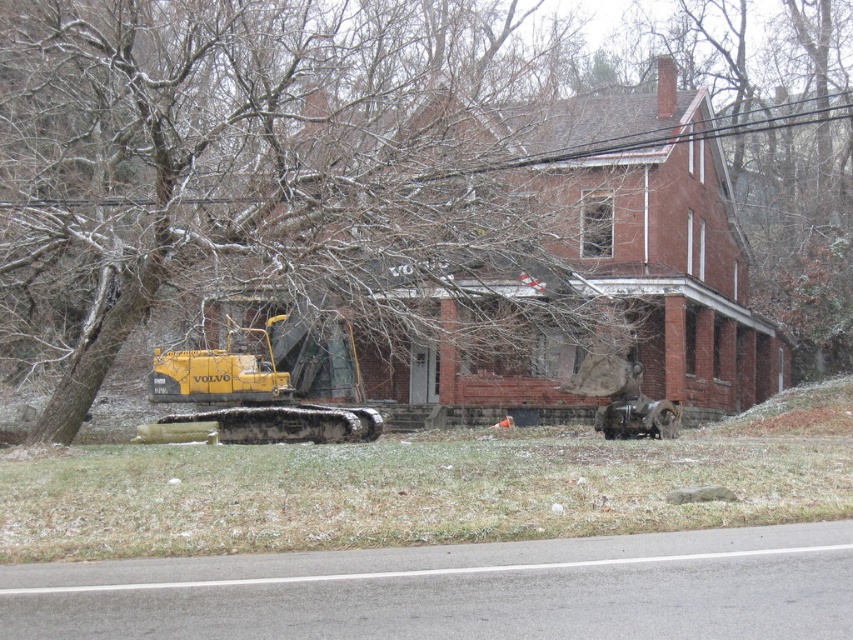
Question: Can you confirm if snow-covered branches at upper left is bigger than yellow rubber plow at left?

Choices:
 (A) no
 (B) yes

Answer: (B)

Question: From the image, what is the correct spatial relationship of snow-covered branches at upper left in relation to yellow rubber plow at left?

Choices:
 (A) below
 (B) above

Answer: (B)

Question: Which point is closer to the camera?

Choices:
 (A) snow-covered branches at upper left
 (B) yellow rubber plow at left

Answer: (A)

Question: Is snow-covered branches at upper left bigger than yellow rubber plow at left?

Choices:
 (A) yes
 (B) no

Answer: (A)